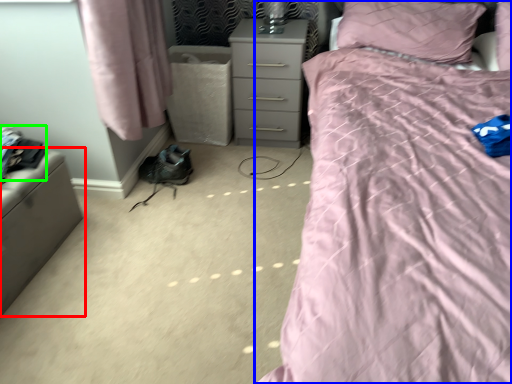
Question: Based on their relative distances, which object is nearer to furniture (highlighted by a red box)? Choose from bed (highlighted by a blue box) and clothing (highlighted by a green box).

Choices:
 (A) bed
 (B) clothing

Answer: (B)